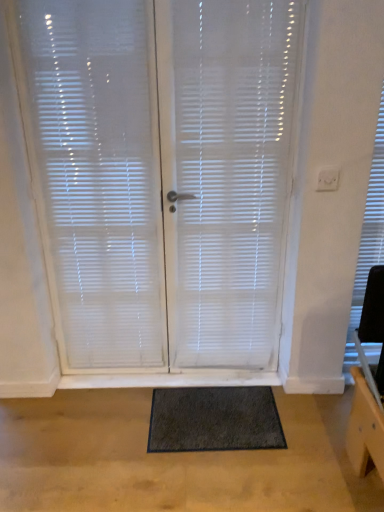
Question: Is white translucent blinds at center inside or outside of dark gray shaggy mat at center?

Choices:
 (A) inside
 (B) outside

Answer: (B)

Question: Is point (193, 99) positioned closer to the camera than point (210, 426)?

Choices:
 (A) closer
 (B) farther

Answer: (A)

Question: Based on their relative distances, which object is farther from the white translucent blinds at center?

Choices:
 (A) white translucent blinds at center
 (B) white painted wood at lower center
 (C) dark gray shaggy mat at center

Answer: (B)

Question: Estimate the real-world distances between objects in this image. Which object is farther from the white translucent blinds at center?

Choices:
 (A) dark gray shaggy mat at center
 (B) white painted wood at lower center
 (C) white translucent blinds at center

Answer: (B)